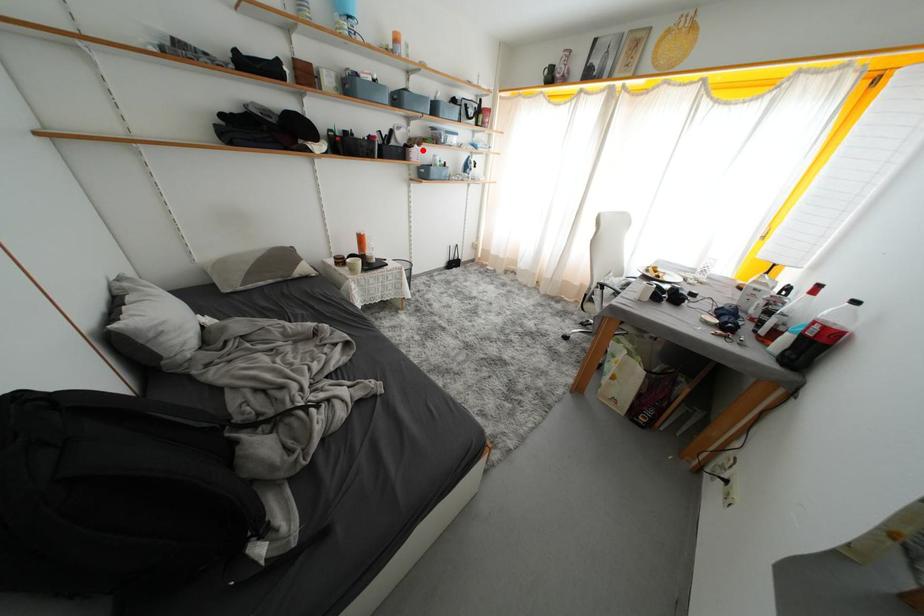
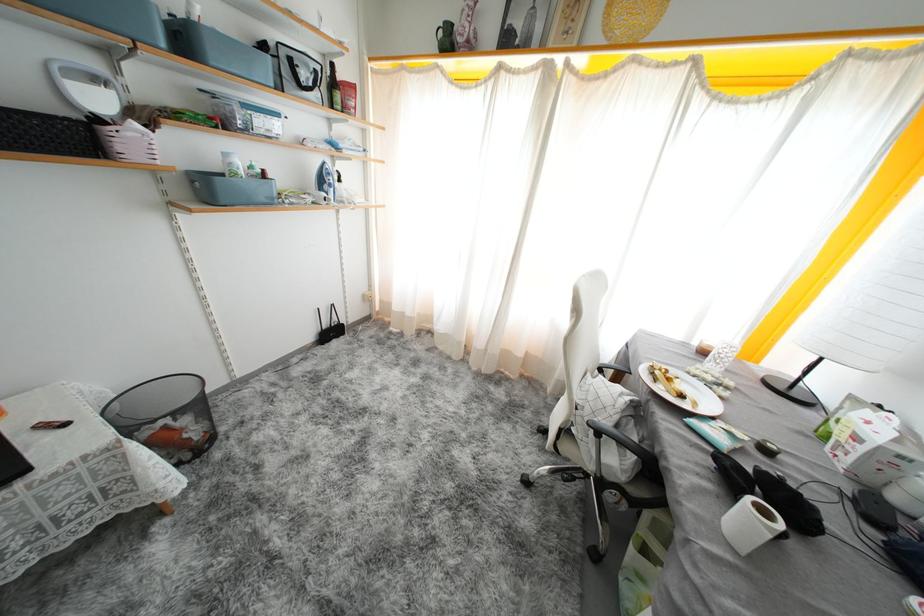
Question: A red point is marked in image1. In image2, is the corresponding 3D point closer to the camera or farther? Reply with the corresponding letter.

Choices:
 (A) The corresponding 3D point is closer.
 (B) The corresponding 3D point is farther.

Answer: (B)